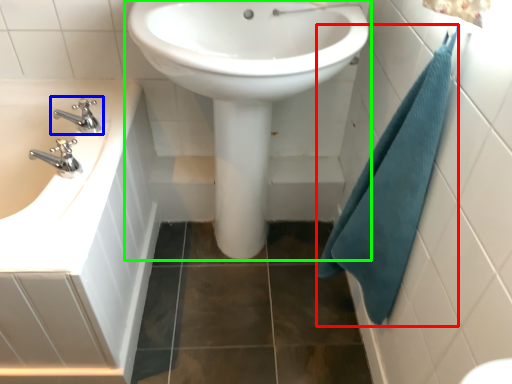
Question: Which object is the closest to the bath towel (highlighted by a red box)? Choose among these: tap (highlighted by a blue box) or sink (highlighted by a green box).

Choices:
 (A) tap
 (B) sink

Answer: (B)